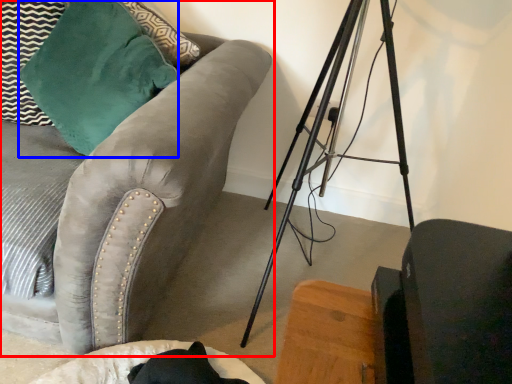
Question: Which object appears closest to the camera in this image, studio couch (highlighted by a red box) or throw pillow (highlighted by a blue box)?

Choices:
 (A) studio couch
 (B) throw pillow

Answer: (A)